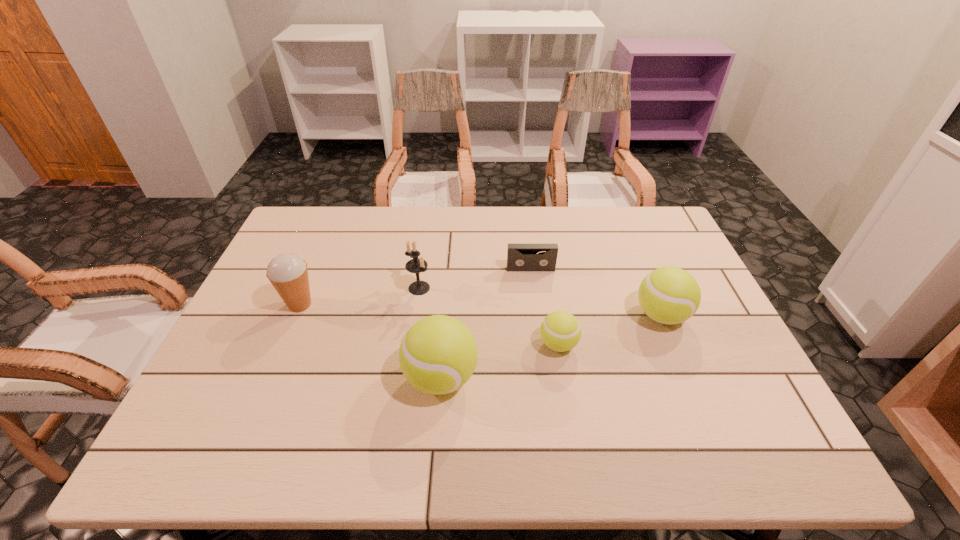
The width and height of the screenshot is (960, 540). In order to click on vacant area situated on the right of the leftmost object in this screenshot , I will do `click(350, 305)`.

The width and height of the screenshot is (960, 540). In order to click on free space located on the right of the candle holder in this screenshot , I will do `click(473, 288)`.

Locate an element on the screen. Image resolution: width=960 pixels, height=540 pixels. free region located on the front-facing side of the farthest object is located at coordinates (533, 287).

I want to click on object present at the near edge, so click(438, 354).

Image resolution: width=960 pixels, height=540 pixels. Identify the location of object present at the left edge. (288, 273).

What are the coordinates of `object present at the right edge` in the screenshot? It's located at (669, 295).

Identify the location of vacant space at the far edge of the desktop. This screenshot has height=540, width=960. (545, 207).

Find the location of `vacant space at the right edge of the desktop`. vacant space at the right edge of the desktop is located at coordinates (708, 338).

I want to click on vacant region between the candle holder and the shortest tennis ball, so click(489, 316).

Locate an element on the screen. This screenshot has height=540, width=960. vacant area that lies between the leftmost tennis ball and the farthest object is located at coordinates (486, 323).